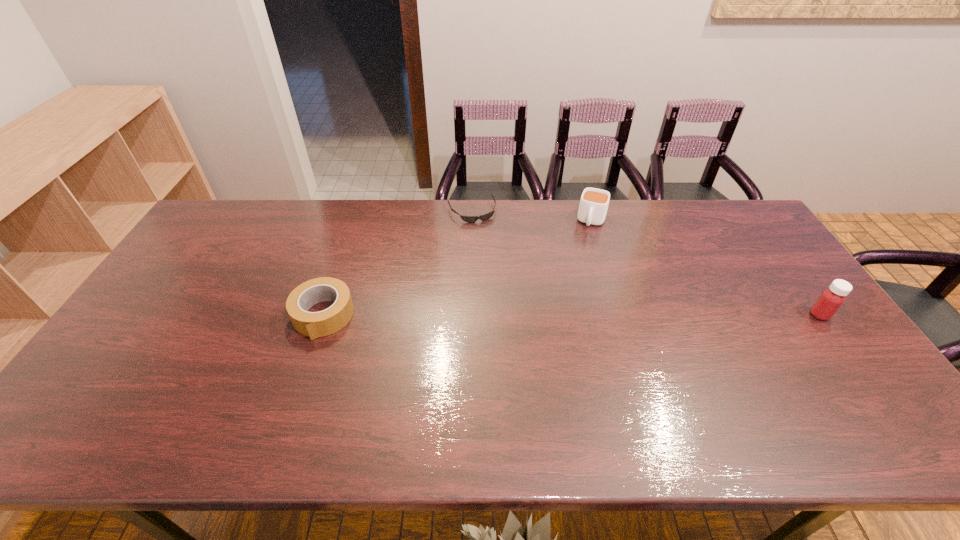
This screenshot has width=960, height=540. Identify the location of the leftmost object. (326, 322).

Identify the location of duct tape. The width and height of the screenshot is (960, 540). (326, 322).

This screenshot has width=960, height=540. I want to click on the tallest object, so click(831, 299).

The image size is (960, 540). Identify the location of medicine. point(831,299).

You are a GUI agent. You are given a task and a screenshot of the screen. Output one action in this format:
    pyautogui.click(x=<x>, y=<y>)
    Task: Click on the cup
    This screenshot has height=540, width=960.
    Given the screenshot: What is the action you would take?
    pyautogui.click(x=593, y=206)

I want to click on the third shortest object, so point(593,206).

I want to click on the second object from left to right, so click(x=470, y=219).

This screenshot has width=960, height=540. I want to click on sunglasses, so click(x=470, y=219).

The image size is (960, 540). Identify the location of free space located 0.130m at the edge of the leftmost object. (300, 383).

Identify the location of vacant space located 0.080m on the left of the tallest object. Image resolution: width=960 pixels, height=540 pixels. (782, 315).